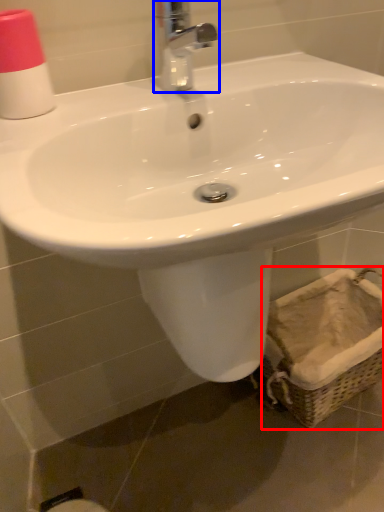
Question: Among these objects, which one is nearest to the camera, basket (highlighted by a red box) or tap (highlighted by a blue box)?

Choices:
 (A) basket
 (B) tap

Answer: (B)